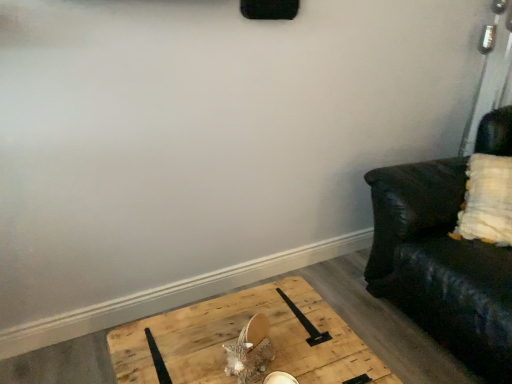
Question: From a real-world perspective, is wooden pallet at lower center above or below black leather couch at right?

Choices:
 (A) above
 (B) below

Answer: (B)

Question: In the image, is wooden pallet at lower center positioned in front of or behind black leather couch at right?

Choices:
 (A) front
 (B) behind

Answer: (A)

Question: Based on their sizes in the image, would you say wooden pallet at lower center is bigger or smaller than black leather couch at right?

Choices:
 (A) small
 (B) big

Answer: (A)

Question: In terms of height, does black leather couch at right look taller or shorter compared to wooden pallet at lower center?

Choices:
 (A) tall
 (B) short

Answer: (A)

Question: From a real-world perspective, is black leather couch at right positioned above or below wooden pallet at lower center?

Choices:
 (A) above
 (B) below

Answer: (A)

Question: In the image, is black leather couch at right positioned in front of or behind wooden pallet at lower center?

Choices:
 (A) front
 (B) behind

Answer: (B)

Question: Looking at their shapes, would you say black leather couch at right is wider or thinner than wooden pallet at lower center?

Choices:
 (A) thin
 (B) wide

Answer: (B)